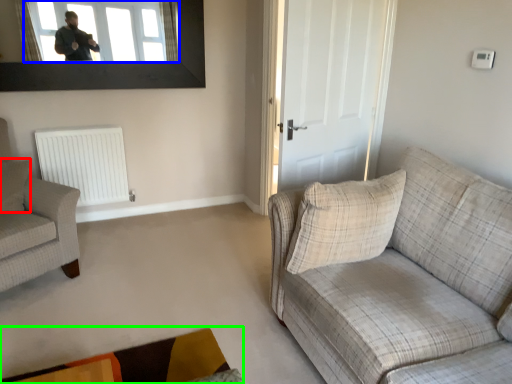
Question: Based on their relative distances, which object is farther from pillow (highlighted by a red box)? Choose from window (highlighted by a blue box) and plain (highlighted by a green box).

Choices:
 (A) window
 (B) plain

Answer: (B)